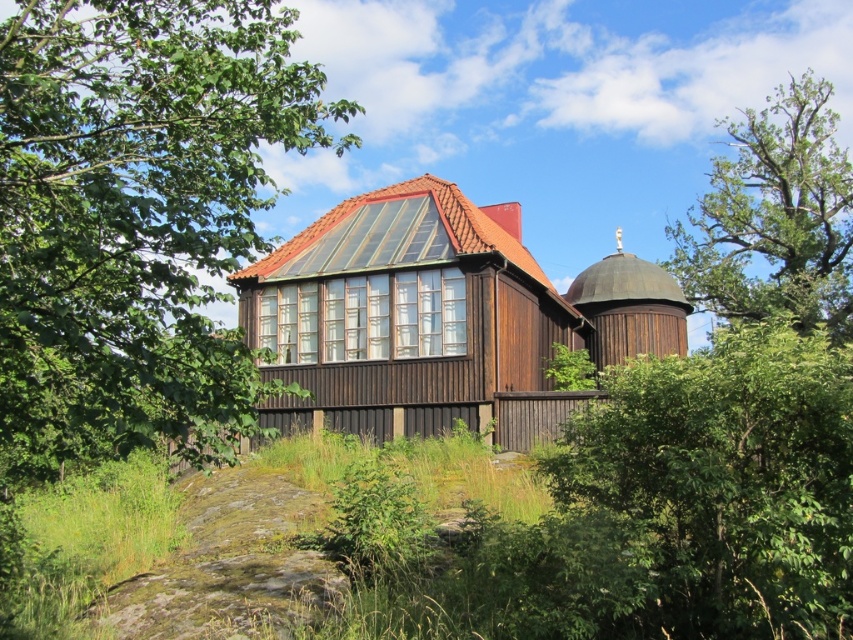
Does green leafy bush at center have a smaller size compared to green leafy tree at upper right?

Yes, green leafy bush at center is smaller than green leafy tree at upper right.

Where is `green leafy bush at center`? green leafy bush at center is located at coordinates (704, 497).

Does point (144, 353) lie behind point (720, 497)?

No, (144, 353) is in front of (720, 497).

What do you see at coordinates (136, 218) in the screenshot?
I see `green leafy tree at upper left` at bounding box center [136, 218].

Locate an element on the screen. green leafy tree at upper left is located at coordinates (136, 218).

Between green leafy tree at upper left and green leafy tree at upper right, which one is positioned lower?

green leafy tree at upper left is lower down.

Who is more distant from viewer, (x=91, y=208) or (x=769, y=166)?

The point (x=769, y=166) is behind.

Where is `green leafy tree at upper left`? The height and width of the screenshot is (640, 853). green leafy tree at upper left is located at coordinates (136, 218).